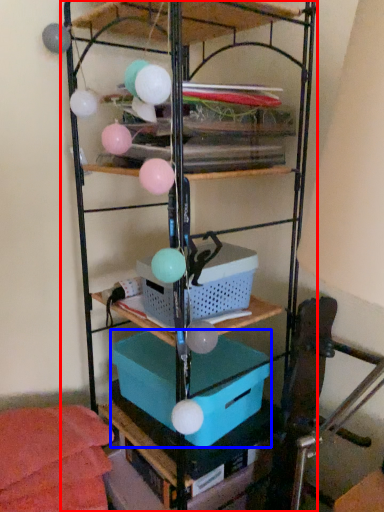
Question: Which object is closer to the camera taking this photo, shelf (highlighted by a red box) or box (highlighted by a blue box)?

Choices:
 (A) shelf
 (B) box

Answer: (A)